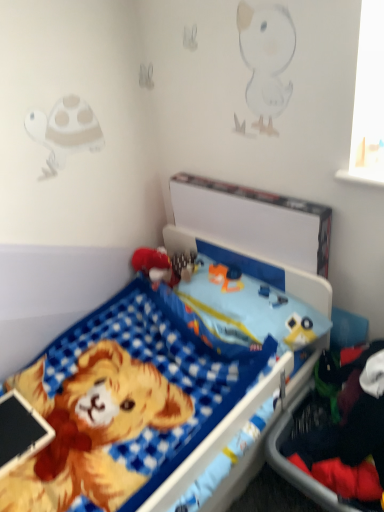
This screenshot has width=384, height=512. What do you see at coordinates (167, 383) in the screenshot?
I see `blue checkered bed at center` at bounding box center [167, 383].

Where is `red plush toy at center`? red plush toy at center is located at coordinates (154, 265).

Measure the distance between dark blue fabric at lower right and camera.

dark blue fabric at lower right and camera are 3.60 feet apart.

The height and width of the screenshot is (512, 384). What do you see at coordinates (346, 437) in the screenshot?
I see `dark blue fabric at lower right` at bounding box center [346, 437].

At what (x,y) coordinates should I click in order to perform the action: click on blue checkered bed at center. Please return your answer as a coordinate pair (x, y). The width and height of the screenshot is (384, 512). Looking at the image, I should click on (167, 383).

From a real-world perspective, which object stands above the other?

In real-world perspective, blue checkered bed at center is above.

Which object is positioned more to the left, dark blue fabric at lower right or blue checkered bed at center?

blue checkered bed at center is more to the left.

Measure the distance from dark blue fabric at lower right to blue checkered bed at center.

The distance of dark blue fabric at lower right from blue checkered bed at center is 14.97 inches.

Between dark blue fabric at lower right and blue checkered bed at center, which one has more height?

blue checkered bed at center.

Considering the sizes of objects red plush toy at center and blue checkered bed at center in the image provided, who is taller, red plush toy at center or blue checkered bed at center?

With more height is blue checkered bed at center.

From a real-world perspective, which is physically below, red plush toy at center or blue checkered bed at center?

blue checkered bed at center, from a real-world perspective.

Does red plush toy at center have a lesser width compared to blue checkered bed at center?

Correct, the width of red plush toy at center is less than that of blue checkered bed at center.

Where is `toy behind the blue checkered bed at center`? This screenshot has width=384, height=512. toy behind the blue checkered bed at center is located at coordinates (154, 265).

From the image's perspective, does blue checkered bed at center appear higher than dark blue fabric at lower right?

Indeed, from the image's perspective, blue checkered bed at center is shown above dark blue fabric at lower right.

Which object is thinner, blue checkered bed at center or dark blue fabric at lower right?

dark blue fabric at lower right is thinner.

Find the location of a particular element. The image size is (384, 512). bed on the left of the dark blue fabric at lower right is located at coordinates (167, 383).

Which object is positioned more to the left, blue checkered bed at center or dark blue fabric at lower right?

blue checkered bed at center is more to the left.

The width and height of the screenshot is (384, 512). Find the location of `clothing below the red plush toy at center (from a real-world perspective)`. clothing below the red plush toy at center (from a real-world perspective) is located at coordinates (346, 437).

In the scene shown: Is red plush toy at center with dark blue fabric at lower right?

No.

Is red plush toy at center at the left side of dark blue fabric at lower right?

Yes.

Who is bigger, red plush toy at center or dark blue fabric at lower right?

dark blue fabric at lower right is bigger.

From a real-world perspective, which object rests below the other?

dark blue fabric at lower right is physically lower.

From the image's perspective, which is above, dark blue fabric at lower right or red plush toy at center?

red plush toy at center, from the image's perspective.

Is dark blue fabric at lower right bigger than red plush toy at center?

Indeed, dark blue fabric at lower right has a larger size compared to red plush toy at center.

Is dark blue fabric at lower right touching red plush toy at center?

They are not placed beside each other.

From a real-world perspective, who is located lower, blue checkered bed at center or red plush toy at center?

From a 3D spatial view, blue checkered bed at center is below.

From the image's perspective, which is above, blue checkered bed at center or red plush toy at center?

red plush toy at center, from the image's perspective.

Can you confirm if blue checkered bed at center is positioned to the left of red plush toy at center?

Incorrect, blue checkered bed at center is not on the left side of red plush toy at center.

Considering the relative sizes of blue checkered bed at center and red plush toy at center in the image provided, is blue checkered bed at center taller than red plush toy at center?

Indeed, blue checkered bed at center has a greater height compared to red plush toy at center.

Find the location of `bed on the left of dark blue fabric at lower right`. bed on the left of dark blue fabric at lower right is located at coordinates (167, 383).

This screenshot has width=384, height=512. What are the coordinates of `toy above the blue checkered bed at center (from a real-world perspective)` in the screenshot? It's located at (154, 265).

Looking at the image, which one is located closer to red plush toy at center, blue checkered bed at center or dark blue fabric at lower right?

Based on the image, blue checkered bed at center appears to be nearer to red plush toy at center.

Looking at the image, which one is located further to blue checkered bed at center, dark blue fabric at lower right or red plush toy at center?

The object further to blue checkered bed at center is red plush toy at center.

From the image, which object appears to be farther from dark blue fabric at lower right, blue checkered bed at center or red plush toy at center?

red plush toy at center is positioned further to the anchor dark blue fabric at lower right.

From the image, which object appears to be farther from blue checkered bed at center, red plush toy at center or dark blue fabric at lower right?

The object further to blue checkered bed at center is red plush toy at center.

When comparing their distances from dark blue fabric at lower right, does red plush toy at center or blue checkered bed at center seem closer?

blue checkered bed at center is closer to dark blue fabric at lower right.

Estimate the real-world distances between objects in this image. Which object is further from red plush toy at center, dark blue fabric at lower right or blue checkered bed at center?

dark blue fabric at lower right.

This screenshot has width=384, height=512. I want to click on clothing between blue checkered bed at center and red plush toy at center in the front-back direction, so click(346, 437).